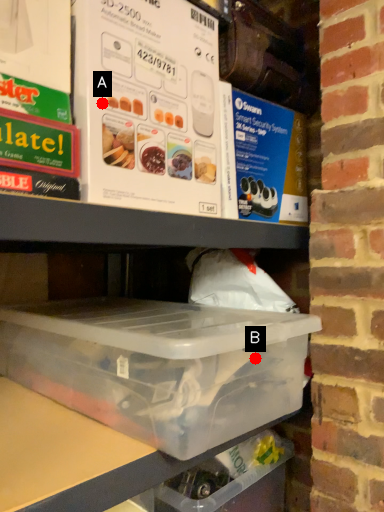
Question: Two points are circled on the image, labeled by A and B beside each circle. Among these points, which one is farthest from the camera?

Choices:
 (A) A is further
 (B) B is further

Answer: (B)